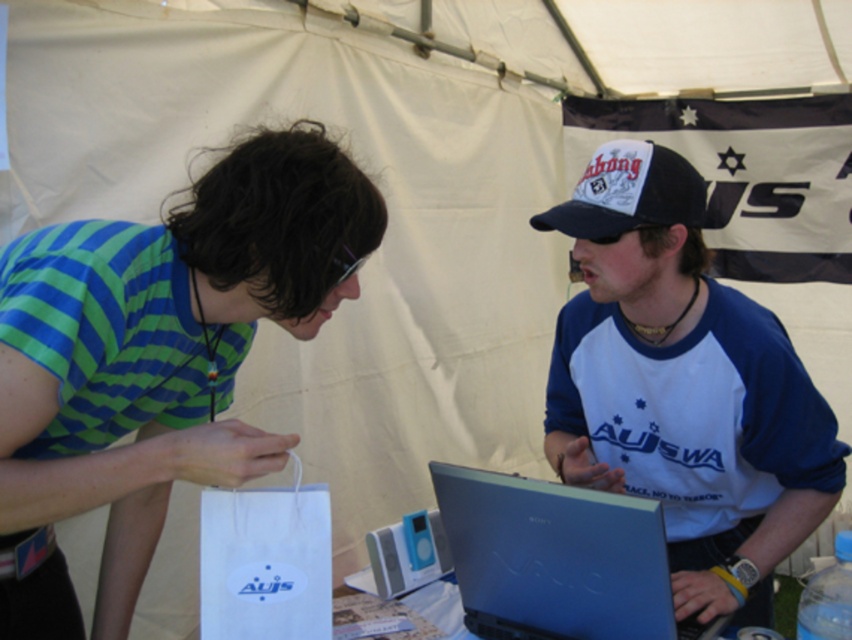
Does matte blue laptop at center appear on the right side of black fabric baseball cap at upper right?

Yes, matte blue laptop at center is to the right of black fabric baseball cap at upper right.

Who is positioned more to the left, matte blue laptop at center or black fabric baseball cap at upper right?

black fabric baseball cap at upper right is more to the left.

The image size is (852, 640). In order to click on matte blue laptop at center in this screenshot , I will do `click(683, 387)`.

Is green striped shirt at left further to camera compared to sleek blue laptop at center?

No, it is in front of sleek blue laptop at center.

Based on the photo, is green striped shirt at left shorter than sleek blue laptop at center?

No, green striped shirt at left is not shorter than sleek blue laptop at center.

Is point (204, 435) positioned in front of point (533, 634)?

Yes.

Identify the location of green striped shirt at left. (157, 358).

Does green striped shirt at left lie in front of matte blue laptop at center?

That is True.

Find the location of a particular element. green striped shirt at left is located at coordinates (157, 358).

Where is `green striped shirt at left`? This screenshot has height=640, width=852. green striped shirt at left is located at coordinates (157, 358).

Find the location of `green striped shirt at left`. green striped shirt at left is located at coordinates click(157, 358).